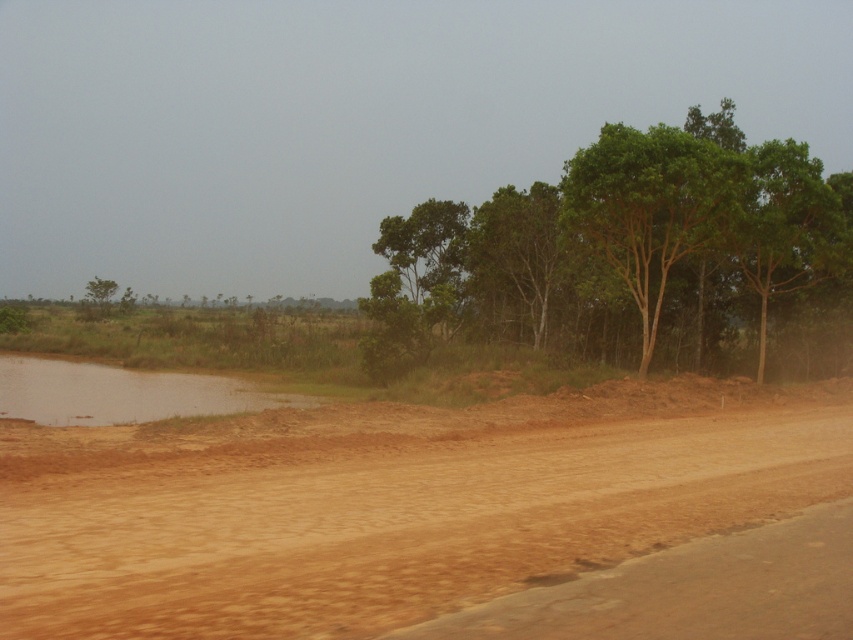
Does point (521, 317) come closer to viewer compared to point (4, 384)?

No, (521, 317) is behind (4, 384).

Is green leafy trees at center thinner than brown muddy water at lower left?

Incorrect, green leafy trees at center's width is not less than brown muddy water at lower left's.

Between point (683, 307) and point (190, 380), which one is positioned behind?

The point (683, 307) is more distant.

This screenshot has width=853, height=640. In order to click on green leafy trees at center in this screenshot , I will do `click(628, 253)`.

Who is lower down, brown sandy dirt at lower left or green leafy tree at right?

Positioned lower is brown sandy dirt at lower left.

Is brown sandy dirt at lower left to the right of green leafy tree at right from the viewer's perspective?

Incorrect, brown sandy dirt at lower left is not on the right side of green leafy tree at right.

Who is more distant from viewer, (x=326, y=618) or (x=723, y=211)?

The point (x=723, y=211) is more distant.

Find the location of a particular element. The width and height of the screenshot is (853, 640). brown sandy dirt at lower left is located at coordinates (387, 502).

Between brown sandy dirt at lower left and brown muddy water at lower left, which one appears on the right side from the viewer's perspective?

Positioned to the right is brown sandy dirt at lower left.

Locate an element on the screen. This screenshot has height=640, width=853. brown sandy dirt at lower left is located at coordinates (387, 502).